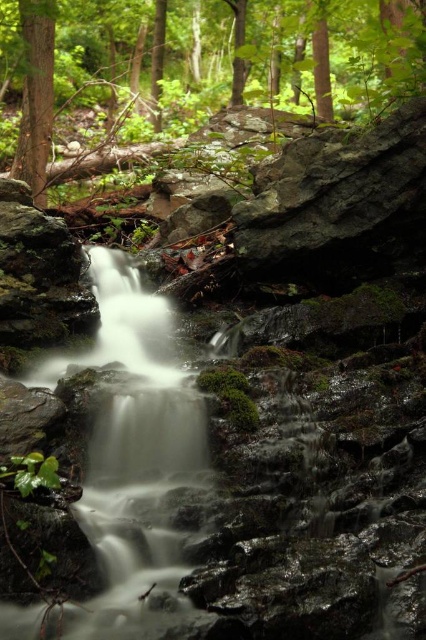
The height and width of the screenshot is (640, 426). Describe the element at coordinates (287, 56) in the screenshot. I see `green matte tree trunk at center` at that location.

Is green matte tree trunk at center to the right of smooth brown tree trunk at upper left from the viewer's perspective?

Correct, you'll find green matte tree trunk at center to the right of smooth brown tree trunk at upper left.

Between point (5, 56) and point (34, 147), which one is positioned in front?

Point (34, 147) is more forward.

You are a GUI agent. You are given a task and a screenshot of the screen. Output one action in this format:
    pyautogui.click(x=<x>, y=<y>)
    Task: Click on the green matte tree trunk at center
    This screenshot has height=640, width=426.
    Given the screenshot: What is the action you would take?
    pyautogui.click(x=287, y=56)